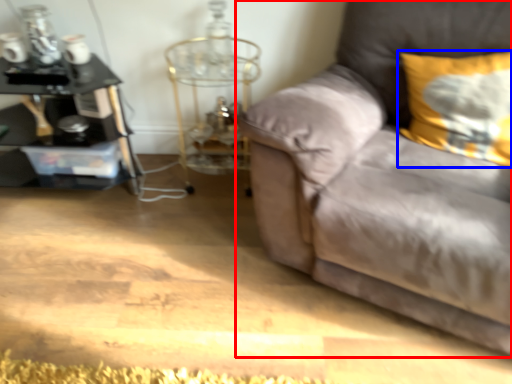
Question: Which of the following is the closest to the observer, studio couch (highlighted by a red box) or pillow (highlighted by a blue box)?

Choices:
 (A) studio couch
 (B) pillow

Answer: (A)